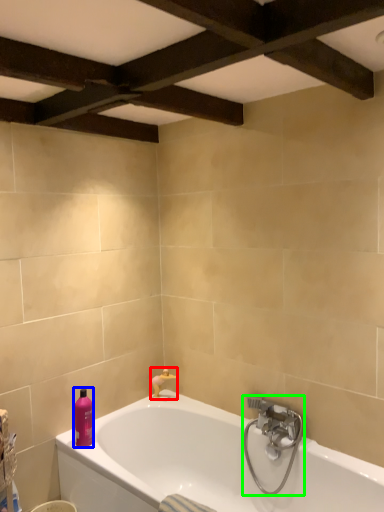
Question: Which object is positioned farthest from faucet (highlighted by a red box)? Select from toiletry (highlighted by a blue box) and tap (highlighted by a green box).

Choices:
 (A) toiletry
 (B) tap

Answer: (B)